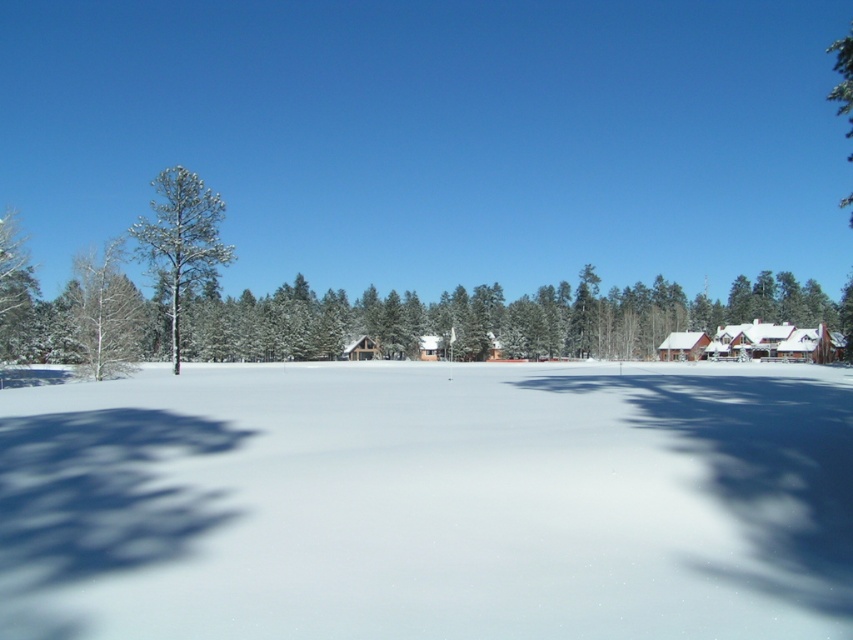
Question: Can you confirm if white fluffy snow at center is bigger than wooden cabin at right?

Choices:
 (A) yes
 (B) no

Answer: (A)

Question: Among these objects, which one is nearest to the camera?

Choices:
 (A) snow-covered pine tree at left
 (B) white smooth tree at left
 (C) white wooden cabin at center

Answer: (B)

Question: Can you confirm if white fluffy snow at center is positioned to the left of wooden cabin at right?

Choices:
 (A) no
 (B) yes

Answer: (B)

Question: Based on their relative distances, which object is nearer to the wooden cabin at right?

Choices:
 (A) white fluffy snow at center
 (B) snow-covered pine tree at left

Answer: (B)

Question: Considering the real-world distances, which object is farthest from the snow-covered pine tree at left?

Choices:
 (A) white fluffy snow at center
 (B) white smooth tree at left
 (C) wooden cabin at right

Answer: (C)

Question: Observing the image, what is the correct spatial positioning of white smooth tree at left in reference to wooden cabin at right?

Choices:
 (A) below
 (B) above

Answer: (B)